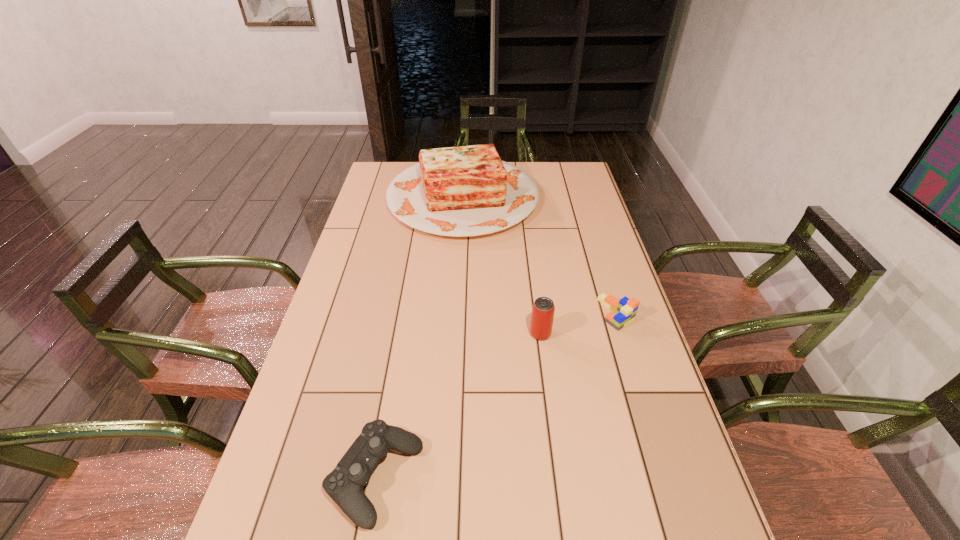
This screenshot has height=540, width=960. Find the location of `lasagna`. lasagna is located at coordinates (463, 191).

Find the location of a particular element. The width and height of the screenshot is (960, 540). the farthest object is located at coordinates (463, 191).

At what (x,y) coordinates should I click in order to perform the action: click on beer can. Please return your answer as a coordinate pair (x, y). Looking at the image, I should click on (543, 309).

The height and width of the screenshot is (540, 960). Find the location of `the nearest object`. the nearest object is located at coordinates (344, 484).

Image resolution: width=960 pixels, height=540 pixels. In order to click on Lego in this screenshot , I will do `click(623, 311)`.

Where is `vacant space located 0.300m on the front of the farthest object`? vacant space located 0.300m on the front of the farthest object is located at coordinates (457, 307).

Image resolution: width=960 pixels, height=540 pixels. What are the coordinates of `blank space located on the back of the second tallest object` in the screenshot? It's located at (528, 238).

The image size is (960, 540). In order to click on vacant area located on the back of the control in this screenshot , I will do `click(392, 386)`.

Locate an element on the screen. The image size is (960, 540). free space located 0.170m on the front of the rightmost object is located at coordinates (638, 384).

Locate an element on the screen. Image resolution: width=960 pixels, height=540 pixels. object situated at the far edge is located at coordinates (463, 191).